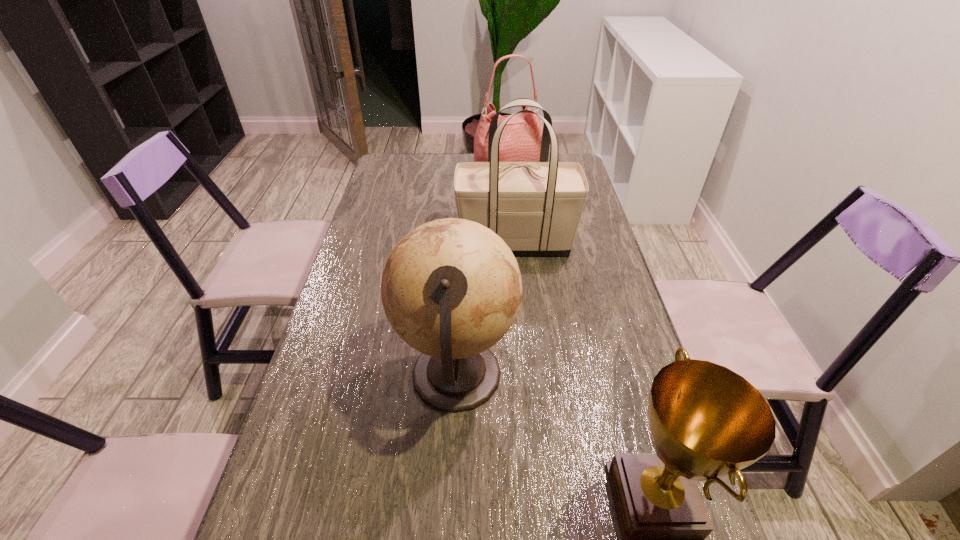
The image size is (960, 540). Find the location of `handbag`. handbag is located at coordinates (521, 138).

Where is `the third nearest object`? The image size is (960, 540). the third nearest object is located at coordinates (535, 207).

This screenshot has height=540, width=960. I want to click on globe, so click(x=451, y=288).

Identify the location of vacant space situated on the front of the handbag. This screenshot has height=540, width=960. (516, 262).

You are a GUI agent. You are given a task and a screenshot of the screen. Output one action in this format:
    pyautogui.click(x=<x>, y=<y>)
    Task: Click on the blank space located 0.310m with handles facing forward on the shopping bag
    This screenshot has width=960, height=540.
    Given the screenshot: What is the action you would take?
    (358, 244)

Locate an element on the screen. The image size is (960, 540). free location located 0.270m with handles facing forward on the shopping bag is located at coordinates (372, 244).

This screenshot has height=540, width=960. Identify the location of vacant area situated with handles facing forward on the shopping bag. (387, 244).

Locate an element on the screen. vacant space located 0.240m on the front-facing side of the globe is located at coordinates (619, 376).

At what (x,y) coordinates should I click in order to perform the action: click on object that is at the far edge. Please return your answer as a coordinate pair (x, y). This screenshot has height=540, width=960. Looking at the image, I should click on (521, 138).

Locate an element on the screen. The image size is (960, 540). handbag that is positioned at the right edge is located at coordinates (521, 138).